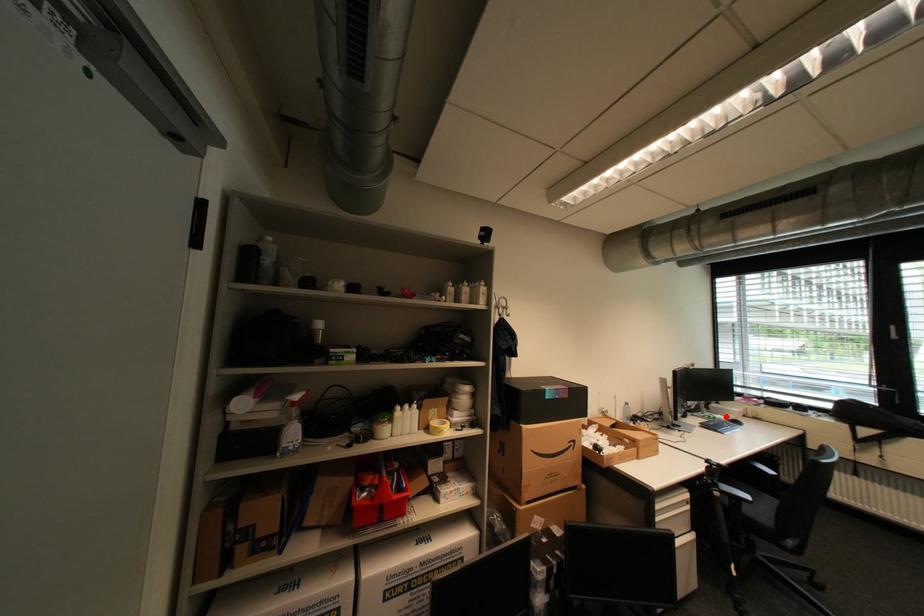
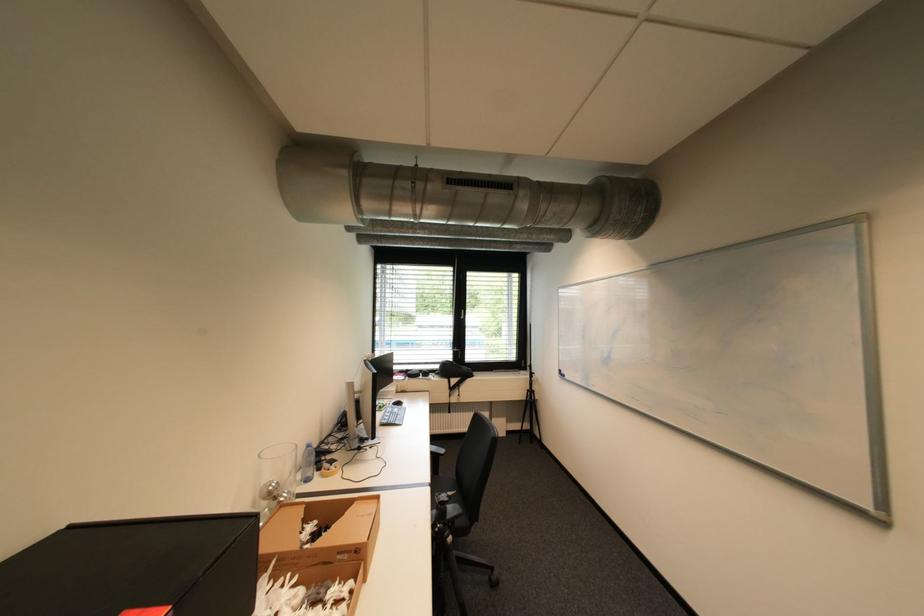
Question: I am providing you with two images of the same scene from different viewpoints. Image1 has a red point marked. In image2, the corresponding 3D location appears at what relative position? Reply with the corresponding letter.

Choices:
 (A) Closer
 (B) Farther

Answer: (B)